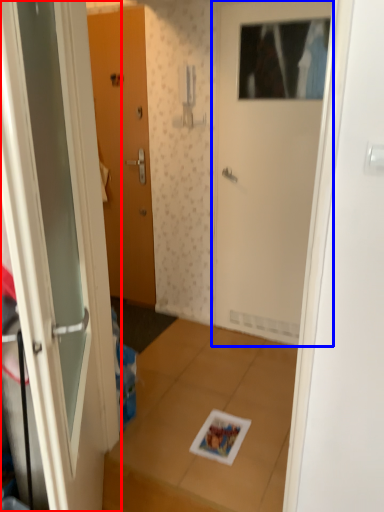
Question: Among these objects, which one is farthest to the camera, door (highlighted by a red box) or door (highlighted by a blue box)?

Choices:
 (A) door
 (B) door

Answer: (B)